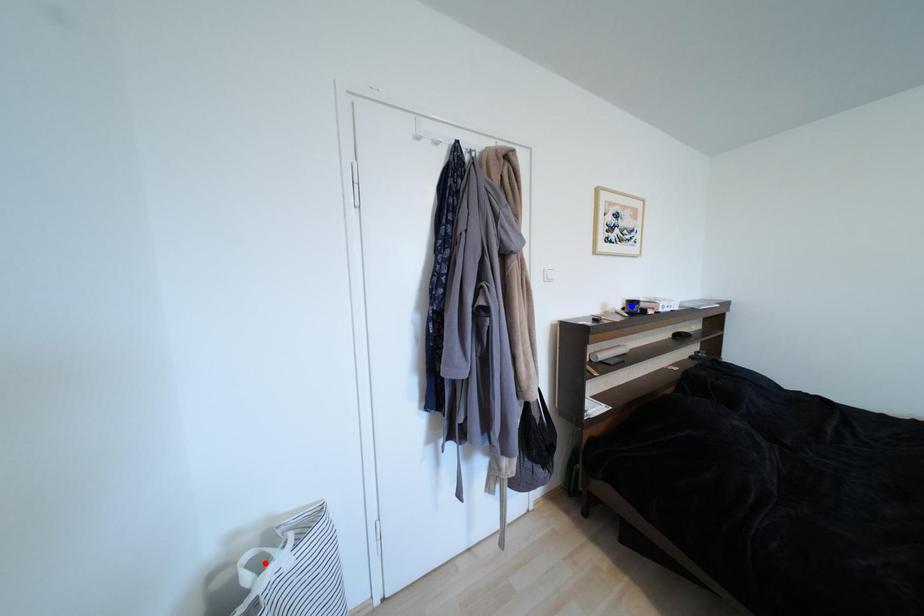
Question: Which of the two points in the image is closer to the camera?

Choices:
 (A) Blue point is closer.
 (B) Red point is closer.

Answer: (B)